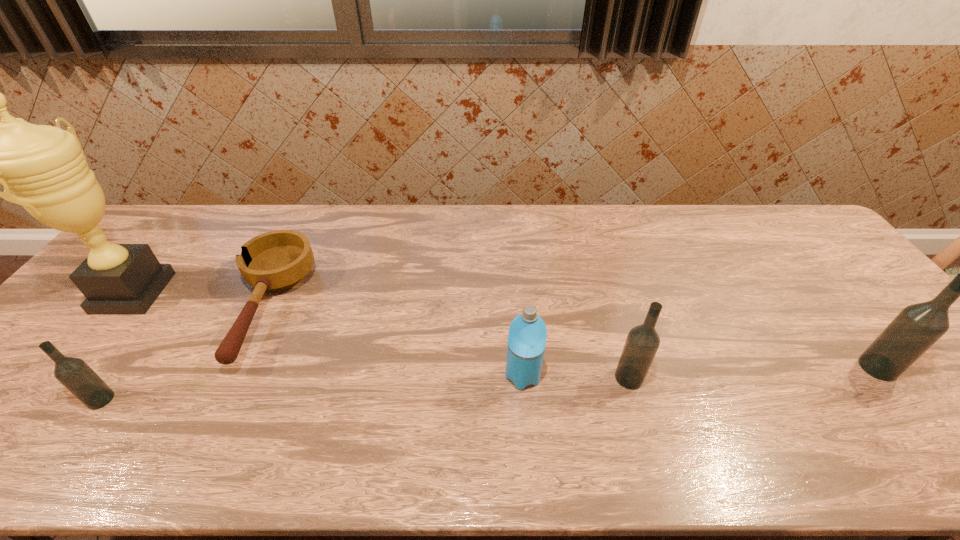
Image resolution: width=960 pixels, height=540 pixels. I want to click on the fifth object from right to left, so click(x=75, y=374).

Identify the location of the shortest vodka. Image resolution: width=960 pixels, height=540 pixels. (75, 374).

Locate an element on the screen. The image size is (960, 540). the second object from right to left is located at coordinates (642, 343).

This screenshot has width=960, height=540. In order to click on the second vodka from left to right in this screenshot , I will do `click(642, 343)`.

Where is `the second tallest object`? the second tallest object is located at coordinates (917, 327).

You are a GUI agent. You are given a task and a screenshot of the screen. Output one action in this format:
    pyautogui.click(x=<x>, y=<y>)
    Task: Click on the rightmost vodka
    The image size is (960, 540).
    Given the screenshot: What is the action you would take?
    coord(917,327)

The height and width of the screenshot is (540, 960). I want to click on trophy cup, so click(x=44, y=167).

At what (x,y) coordinates should I click in order to perform the action: click on the leftmost object. Please return your answer as a coordinate pair (x, y). Image resolution: width=960 pixels, height=540 pixels. Looking at the image, I should click on (44, 167).

Where is `the shortest object`? The height and width of the screenshot is (540, 960). the shortest object is located at coordinates (277, 260).

Where is `the fourth object from right to left`? This screenshot has width=960, height=540. the fourth object from right to left is located at coordinates (277, 260).